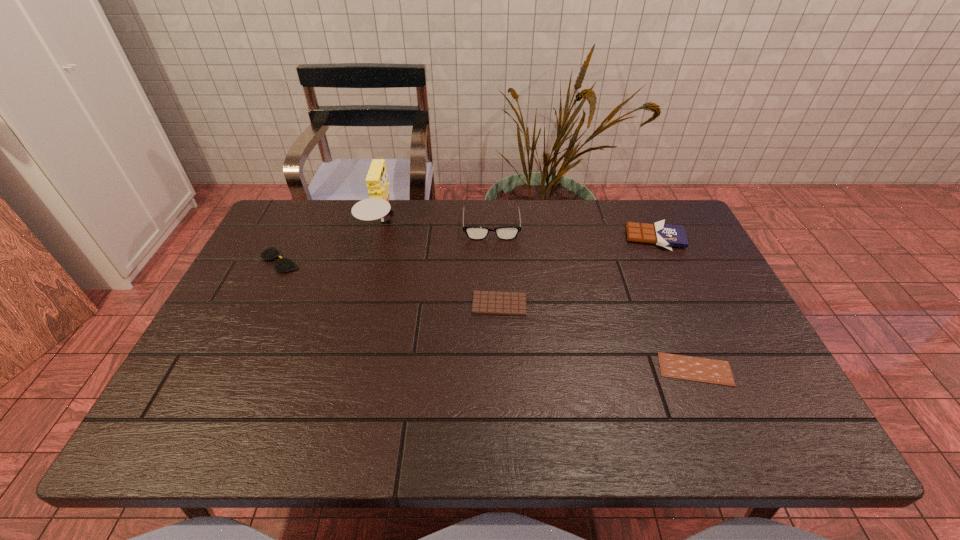
What are the coordinates of `the closest chocolate bar to the shortest object` in the screenshot? It's located at (484, 302).

At what (x,y) coordinates should I click in order to perform the action: click on blank area in the image that satisfies the following two spatial constraints: 1. on the front-facing side of the second tallest object; 2. on the left side of the shortest object. Please return your answer as a coordinate pair (x, y). Looking at the image, I should click on (495, 369).

This screenshot has height=540, width=960. Find the location of `blank area in the image that satisfies the following two spatial constraints: 1. on the front-facing side of the taller spectacles; 2. on the right side of the fourth shortest object`. blank area in the image that satisfies the following two spatial constraints: 1. on the front-facing side of the taller spectacles; 2. on the right side of the fourth shortest object is located at coordinates 492,238.

Locate an element on the screen. This screenshot has height=540, width=960. free spot that satisfies the following two spatial constraints: 1. on the front-facing side of the second object from left to right; 2. on the back side of the second shortest chocolate bar is located at coordinates (362, 304).

Locate an element on the screen. vacant region that satisfies the following two spatial constraints: 1. on the front-facing side of the farthest chocolate bar; 2. on the left side of the tallest object is located at coordinates (379, 238).

Locate an element on the screen. The image size is (960, 540). free location that satisfies the following two spatial constraints: 1. on the front-facing side of the right spectacles; 2. on the left side of the second tallest chocolate bar is located at coordinates (493, 304).

Where is `free spot that satisfies the following two spatial constraints: 1. on the front side of the second shortest object; 2. on the right side of the shortest chocolate bar`? This screenshot has width=960, height=540. free spot that satisfies the following two spatial constraints: 1. on the front side of the second shortest object; 2. on the right side of the shortest chocolate bar is located at coordinates (502, 369).

You are a GUI agent. You are given a task and a screenshot of the screen. Output one action in this format:
    pyautogui.click(x=<x>, y=<y>)
    Task: Click on the free space that satisfies the following two spatial constraints: 1. on the front-facing side of the sponge; 2. on the right side of the nearest chocolate bar
    
    Given the screenshot: What is the action you would take?
    pyautogui.click(x=345, y=369)

What are the coordinates of `vacant region that satisfies the following two spatial constraints: 1. on the back side of the nearest object; 2. on the front-facing side of the sponge` in the screenshot? It's located at (636, 226).

Locate an element on the screen. This screenshot has width=960, height=540. blank space that satisfies the following two spatial constraints: 1. on the front-facing side of the tallest object; 2. on the right side of the second shortest chocolate bar is located at coordinates (362, 304).